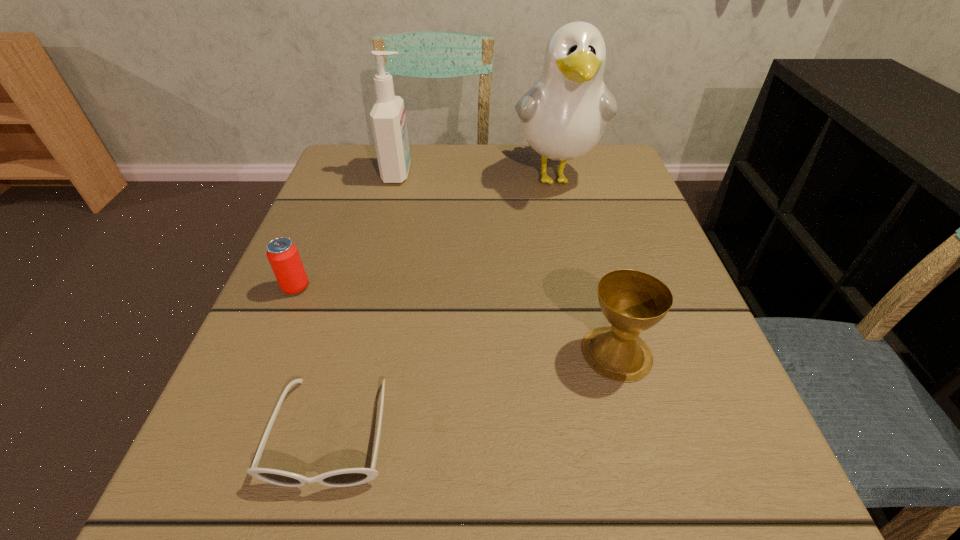
I want to click on object present at the far right corner, so click(563, 116).

In the image, there is a desktop. At what (x,y) coordinates should I click in order to perform the action: click on vacant region at the far edge. Please return your answer as a coordinate pair (x, y). Looking at the image, I should click on (557, 176).

At what (x,y) coordinates should I click in order to perform the action: click on free region at the near edge of the desktop. Please return your answer as a coordinate pair (x, y). Looking at the image, I should click on (509, 525).

Find the location of a particular element. free space at the left edge of the desktop is located at coordinates (365, 285).

Find the location of `free space at the right edge`. free space at the right edge is located at coordinates (749, 456).

Find the location of a particular element. The height and width of the screenshot is (540, 960). vacant region at the far left corner of the desktop is located at coordinates (371, 173).

Image resolution: width=960 pixels, height=540 pixels. Identify the location of free region at the far right corner of the desktop. (599, 163).

Where is `vacant area between the chalice and the beer can`? vacant area between the chalice and the beer can is located at coordinates (456, 320).

You are a GUI agent. You are given a task and a screenshot of the screen. Output one action in this format:
    pyautogui.click(x=<x>, y=<y>)
    Task: Click on the free space between the tallest object and the cleansing agent
    The image size is (960, 540).
    Given the screenshot: What is the action you would take?
    [477, 175]

What are the coordinates of `free space between the gull and the leftmost object` in the screenshot? It's located at (425, 232).